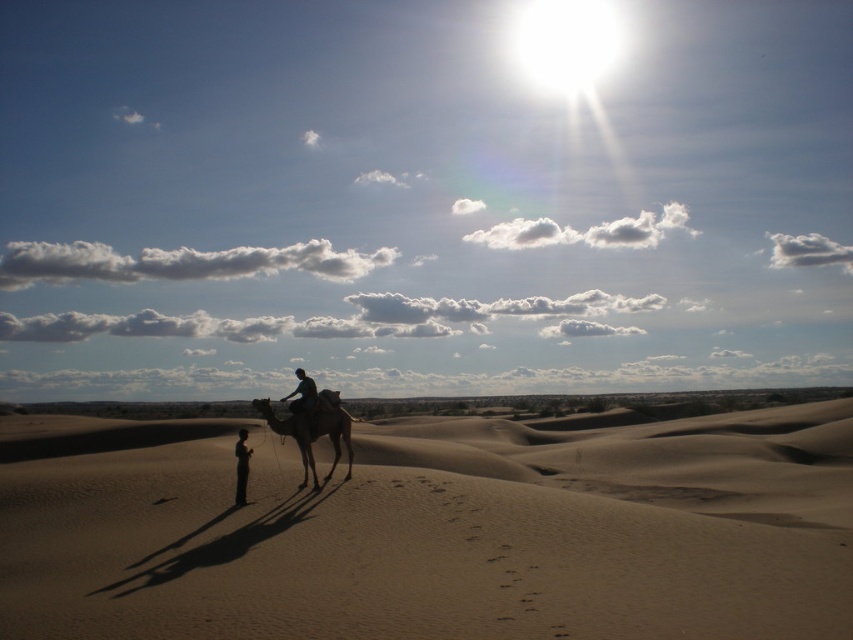
Who is higher up, brown textured camel at center or smooth beige camel at center?

Positioned higher is brown textured camel at center.

Can you confirm if brown textured camel at center is smaller than smooth beige camel at center?

Correct, brown textured camel at center occupies less space than smooth beige camel at center.

Find the location of `brown textured camel at center`. brown textured camel at center is located at coordinates (312, 432).

Does smooth sand dune at center have a greater height compared to smooth beige camel at center?

Indeed, smooth sand dune at center has a greater height compared to smooth beige camel at center.

Can you confirm if smooth sand dune at center is thinner than smooth beige camel at center?

In fact, smooth sand dune at center might be wider than smooth beige camel at center.

Identify the location of smooth sand dune at center. This screenshot has height=640, width=853. (434, 531).

Is smooth sand dune at center taller than silhouette human at center?

Yes.

Does point (219, 556) lie behind point (312, 385)?

No, (219, 556) is closer to viewer.

Image resolution: width=853 pixels, height=640 pixels. In order to click on smooth sand dune at center in this screenshot , I will do `click(434, 531)`.